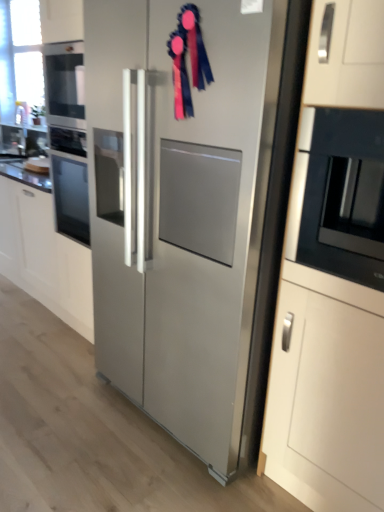
Question: Is white glossy countertop at left completely or partially outside of brushed metal sink at left?

Choices:
 (A) no
 (B) yes

Answer: (B)

Question: Does white glossy countertop at left have a larger size compared to brushed metal sink at left?

Choices:
 (A) yes
 (B) no

Answer: (A)

Question: Is white glossy countertop at left aimed at brushed metal sink at left?

Choices:
 (A) yes
 (B) no

Answer: (B)

Question: Is white glossy countertop at left wider than brushed metal sink at left?

Choices:
 (A) no
 (B) yes

Answer: (B)

Question: From the image's perspective, is white glossy countertop at left on brushed metal sink at left?

Choices:
 (A) yes
 (B) no

Answer: (B)

Question: Considering the relative sizes of white glossy countertop at left and brushed metal sink at left in the image provided, is white glossy countertop at left taller than brushed metal sink at left?

Choices:
 (A) yes
 (B) no

Answer: (B)

Question: Considering the relative sizes of white glossy countertop at left and black glossy microwave at right in the image provided, is white glossy countertop at left smaller than black glossy microwave at right?

Choices:
 (A) no
 (B) yes

Answer: (B)

Question: From the image's perspective, is white glossy countertop at left on black glossy microwave at right?

Choices:
 (A) yes
 (B) no

Answer: (A)

Question: Is there a large distance between white glossy countertop at left and black glossy microwave at right?

Choices:
 (A) yes
 (B) no

Answer: (A)

Question: Is white glossy countertop at left at the left side of black glossy microwave at right?

Choices:
 (A) yes
 (B) no

Answer: (A)

Question: Considering the relative sizes of white glossy countertop at left and black glossy microwave at right in the image provided, is white glossy countertop at left wider than black glossy microwave at right?

Choices:
 (A) yes
 (B) no

Answer: (A)

Question: Is the depth of white glossy countertop at left less than that of black glossy microwave at right?

Choices:
 (A) yes
 (B) no

Answer: (B)

Question: Does black glossy microwave at right have a lesser height compared to blue satin ribbon at upper center?

Choices:
 (A) yes
 (B) no

Answer: (B)